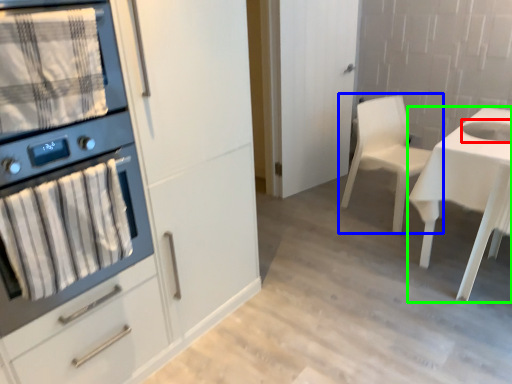
Question: Which object is the farthest from sink (highlighted by a red box)? Choose among these: chair (highlighted by a blue box) or desk (highlighted by a green box).

Choices:
 (A) chair
 (B) desk

Answer: (A)